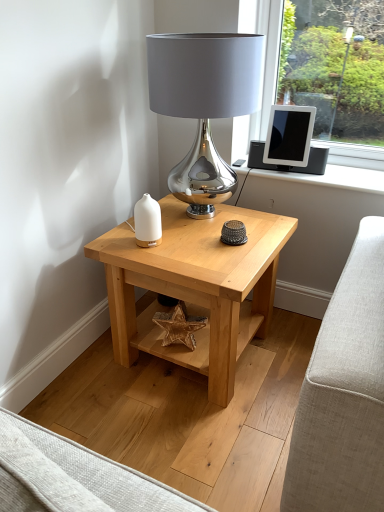
Locate an element on the screen. satin silver lamp at center is located at coordinates (204, 104).

The height and width of the screenshot is (512, 384). I want to click on matte black tablet at upper right, so 289,136.

Is satin silver lamp at center bigger than white matte vase at center?

Yes.

Is point (194, 117) less distant than point (146, 214)?

Yes, it is in front of point (146, 214).

Considering the relative positions of satin silver lamp at center and white matte vase at center in the image provided, is satin silver lamp at center to the right of white matte vase at center from the viewer's perspective?

Yes.

From their relative heights in the image, would you say matte black tablet at upper right is taller or shorter than white matte vase at center?

matte black tablet at upper right is taller than white matte vase at center.

Is point (290, 126) less distant than point (136, 207)?

No, (290, 126) is behind (136, 207).

Measure the distance between matte black tablet at upper right and white matte vase at center.

66.92 centimeters.

Considering the relative sizes of white matte vase at center and matte black tablet at upper right in the image provided, is white matte vase at center bigger than matte black tablet at upper right?

Actually, white matte vase at center might be smaller than matte black tablet at upper right.

From the image's perspective, is white matte vase at center on matte black tablet at upper right?

No, from the image's perspective, white matte vase at center is not on top of matte black tablet at upper right.

Between white matte vase at center and matte black tablet at upper right, which one has more height?

Standing taller between the two is matte black tablet at upper right.

From a real-world perspective, is white matte vase at center positioned above or below matte black tablet at upper right?

Clearly, from a real-world perspective, white matte vase at center is below matte black tablet at upper right.

Are light wood table at center and matte black tablet at upper right making contact?

There is a gap between light wood table at center and matte black tablet at upper right.

Considering the relative sizes of light wood table at center and matte black tablet at upper right in the image provided, is light wood table at center bigger than matte black tablet at upper right?

Indeed, light wood table at center has a larger size compared to matte black tablet at upper right.

Find the location of `table below the matte black tablet at upper right (from a real-world perspective)`. table below the matte black tablet at upper right (from a real-world perspective) is located at coordinates (195, 287).

From a real-world perspective, is light wood table at center physically located above or below matte black tablet at upper right?

light wood table at center is below matte black tablet at upper right.

From the image's perspective, is satin silver lamp at center above or below light wood table at center?

Based on their image positions, satin silver lamp at center is located above light wood table at center.

How much distance is there between satin silver lamp at center and light wood table at center?

satin silver lamp at center and light wood table at center are 23.60 inches apart.

You are a GUI agent. You are given a task and a screenshot of the screen. Output one action in this format:
    pyautogui.click(x=<x>, y=<y>)
    Task: Click on the table located behind the satin silver lamp at center
    This screenshot has width=384, height=512.
    Given the screenshot: What is the action you would take?
    pyautogui.click(x=195, y=287)

Does satin silver lamp at center come in front of light wood table at center?

Yes, it is.

From a real-world perspective, is light wood table at center below white matte vase at center?

Correct, in the physical world, light wood table at center is lower than white matte vase at center.

Considering the sizes of objects light wood table at center and white matte vase at center in the image provided, who is taller, light wood table at center or white matte vase at center?

light wood table at center.

Between point (146, 201) and point (199, 281), which one is positioned behind?

The point (146, 201) is more distant.

Is white matte vase at center taller than light wood table at center?

No, white matte vase at center is not taller than light wood table at center.

Is white matte vase at center positioned with its back to light wood table at center?

No, white matte vase at center's orientation is not away from light wood table at center.

Considering the positions of objects white matte vase at center and light wood table at center in the image provided, who is in front, white matte vase at center or light wood table at center?

light wood table at center is more forward.

Image resolution: width=384 pixels, height=512 pixels. Find the location of `candle holder on the left of satin silver lamp at center`. candle holder on the left of satin silver lamp at center is located at coordinates (147, 222).

Identify the location of candle holder located underneath the matte black tablet at upper right (from a real-world perspective). Image resolution: width=384 pixels, height=512 pixels. (147, 222).

Which object lies nearer to the anchor point matte black tablet at upper right, white matte vase at center or light wood table at center?

light wood table at center is positioned closer to the anchor matte black tablet at upper right.

When comparing their distances from light wood table at center, does satin silver lamp at center or matte black tablet at upper right seem further?

The object further to light wood table at center is matte black tablet at upper right.

Based on their spatial positions, is satin silver lamp at center or light wood table at center further from white matte vase at center?

Among the two, satin silver lamp at center is located further to white matte vase at center.

From the image, which object appears to be farther from matte black tablet at upper right, light wood table at center or white matte vase at center?

The object further to matte black tablet at upper right is white matte vase at center.

When comparing their distances from light wood table at center, does white matte vase at center or satin silver lamp at center seem closer?

The object closer to light wood table at center is white matte vase at center.

From the image, which object appears to be farther from white matte vase at center, matte black tablet at upper right or light wood table at center?

matte black tablet at upper right is positioned further to the anchor white matte vase at center.

From the image, which object appears to be nearer to matte black tablet at upper right, white matte vase at center or satin silver lamp at center?

satin silver lamp at center is closer to matte black tablet at upper right.

Looking at the image, which one is located closer to satin silver lamp at center, matte black tablet at upper right or light wood table at center?

matte black tablet at upper right is positioned closer to the anchor satin silver lamp at center.

Locate an element on the screen. This screenshot has height=512, width=384. candle holder between matte black tablet at upper right and light wood table at center vertically is located at coordinates (147, 222).

Where is `lamp located between white matte vase at center and matte black tablet at upper right in the left-right direction`? lamp located between white matte vase at center and matte black tablet at upper right in the left-right direction is located at coordinates (204, 104).

Locate an element on the screen. candle holder between satin silver lamp at center and light wood table at center from top to bottom is located at coordinates (147, 222).

Locate an element on the screen. Image resolution: width=384 pixels, height=512 pixels. lamp that lies between matte black tablet at upper right and light wood table at center from top to bottom is located at coordinates (204, 104).